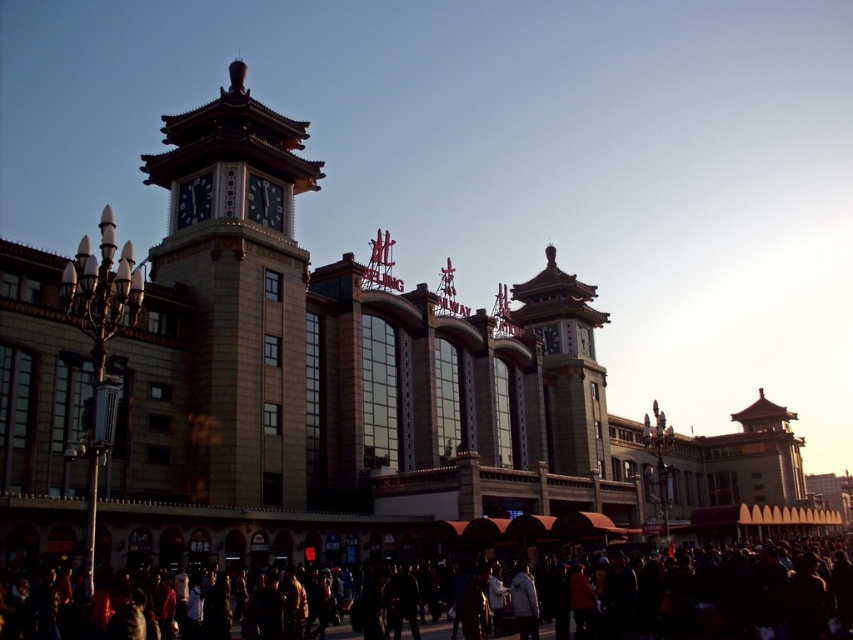
You are a tourist standing in front of the building and want to take a photo that includes both the dark clothing at lower center and the golden stone tower at center. Based on their sizes, which object should you focus on first to ensure both are in frame?

The dark clothing at lower center is not as tall as the golden stone tower at center, so you should focus on the golden stone tower at center first to ensure both fit in the frame.

Looking at this image, you are a tourist standing in the square in front of the building. You see the dark clothing at lower center and the golden stone tower at center. Which object is closer to you?

The dark clothing at lower center is closer to you because it is in front of the golden stone tower at center.